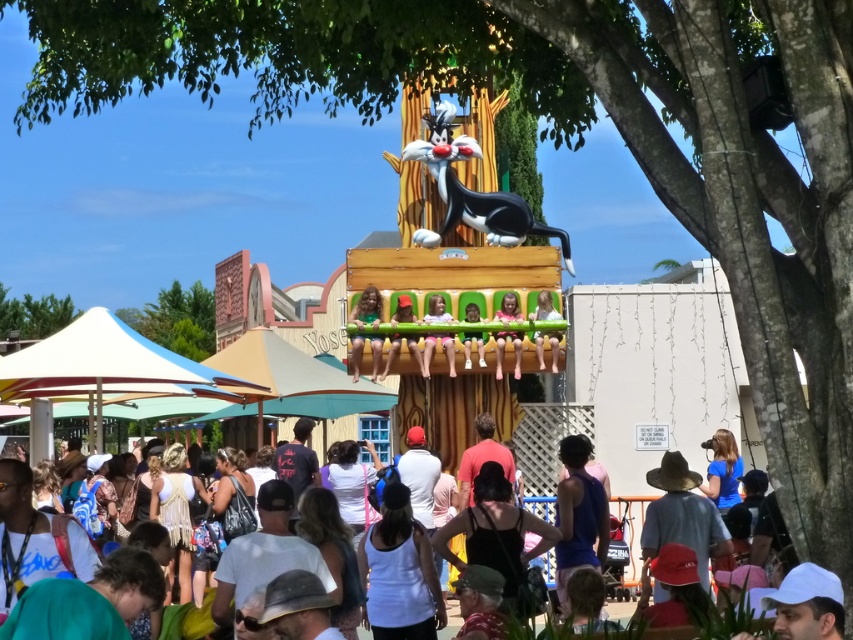
Between pastel plastic seats at center and white cotton crowd at lower center, which one appears on the right side from the viewer's perspective?

From the viewer's perspective, white cotton crowd at lower center appears more on the right side.

Does pastel plastic seats at center have a lesser width compared to white cotton crowd at lower center?

Yes.

The height and width of the screenshot is (640, 853). Find the location of `pastel plastic seats at center`. pastel plastic seats at center is located at coordinates (480, 333).

Where is `pastel plastic seats at center`? pastel plastic seats at center is located at coordinates (480, 333).

Can you confirm if pastel plastic seats at center is positioned above green fabric chair at center?

Yes, pastel plastic seats at center is above green fabric chair at center.

Who is taller, pastel plastic seats at center or green fabric chair at center?

pastel plastic seats at center is taller.

The width and height of the screenshot is (853, 640). What are the coordinates of `pastel plastic seats at center` in the screenshot? It's located at (480, 333).

Between matte pink dress at center and white cotton crowd at lower center, which one is positioned lower?

white cotton crowd at lower center

Which is above, matte pink dress at center or white cotton crowd at lower center?

matte pink dress at center is above.

What do you see at coordinates (503, 352) in the screenshot? The height and width of the screenshot is (640, 853). I see `matte pink dress at center` at bounding box center [503, 352].

Locate an element on the screen. The height and width of the screenshot is (640, 853). matte pink dress at center is located at coordinates (503, 352).